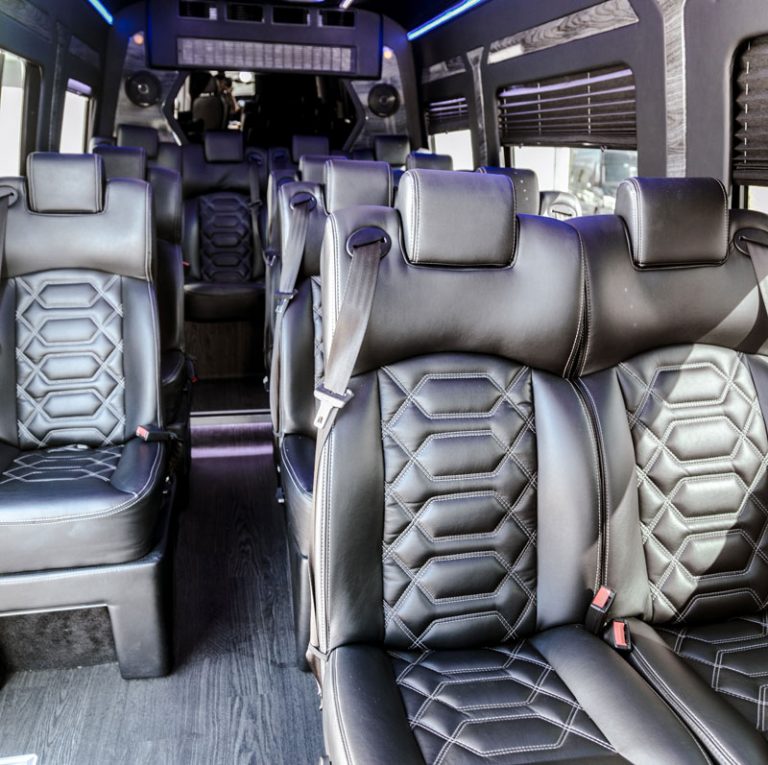
At what (x,y) coordinates should I click in order to perform the action: click on seat cushions. Please return your answer as a coordinate pair (x, y). The width and height of the screenshot is (768, 765). Looking at the image, I should click on (544, 702), (723, 671), (80, 506), (290, 461).